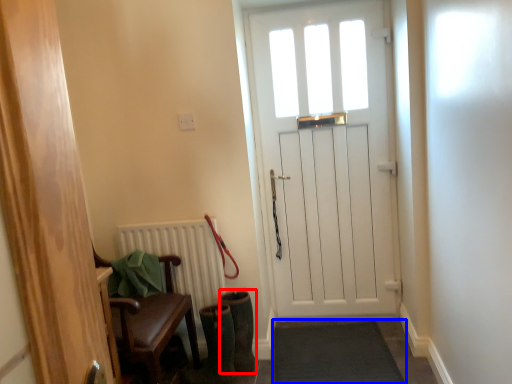
Question: Which of the following is the closest to the observer, boot (highlighted by a red box) or doormat (highlighted by a blue box)?

Choices:
 (A) boot
 (B) doormat

Answer: (B)